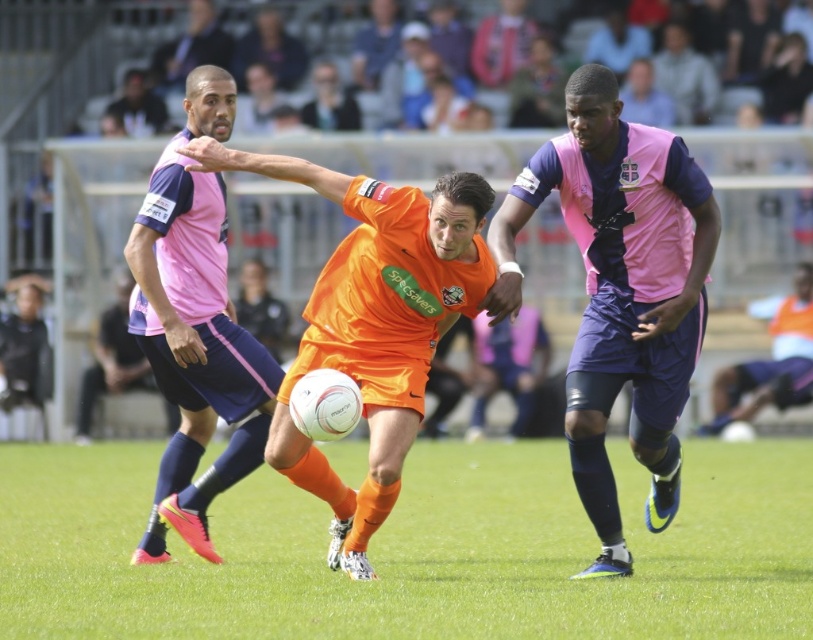
You are a referee watching the soccer match and need to determine if the pink matte jersey at center has a legal height advantage over the orange matte soccer player at center. According to FIFA rules, players must not be taller than 2 meters. Can you confirm if both players comply with this rule?

The pink matte jersey at center is much taller than orange matte soccer player at center. Since FIFA rules state players must not exceed 2 meters, and the pink jersey player is taller, it is possible that they may both comply if both are under 2 meters. However, without exact measurements, we cannot confirm.

You are a soccer coach analyzing the match. You notice the green grass at center and the pink matte jersey at center in the image. Which object is shorter in height?

The green grass at center is shorter in height compared to the pink matte jersey at center.